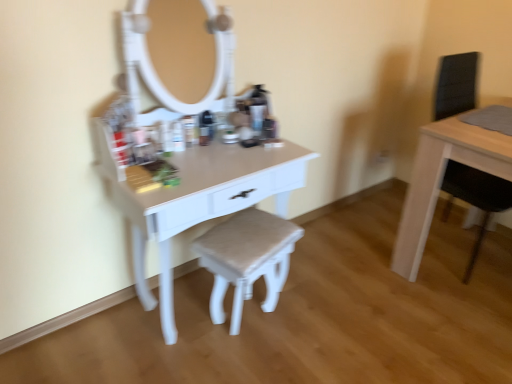
Question: From a real-world perspective, relative to matte white stool at center, is white glossy table at center, which ranks as the 2th table in right-to-left order, vertically above or below?

Choices:
 (A) above
 (B) below

Answer: (A)

Question: Considering the positions of white glossy table at center, which ranks as the 2th table in right-to-left order, and matte white stool at center in the image, is white glossy table at center, which ranks as the 2th table in right-to-left order, bigger or smaller than matte white stool at center?

Choices:
 (A) big
 (B) small

Answer: (A)

Question: Which is farther from the white glossy table at center, marked as the 1th table in a left-to-right arrangement?

Choices:
 (A) matte white stool at center
 (B) light wood table at right, acting as the first table starting from the right

Answer: (B)

Question: Estimate the real-world distances between objects in this image. Which object is farther from the white glossy table at center, which ranks as the 2th table in right-to-left order?

Choices:
 (A) matte white stool at center
 (B) light wood table at right, acting as the first table starting from the right

Answer: (B)